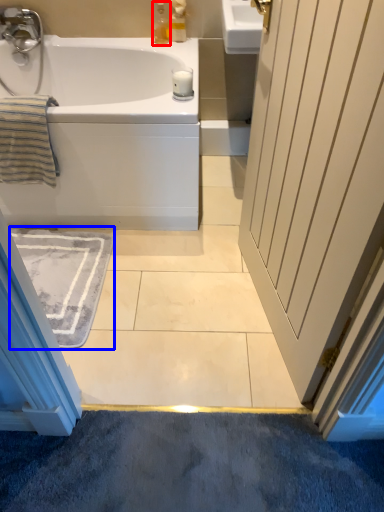
Question: Among these objects, which one is farthest to the camera, soap dispenser (highlighted by a red box) or bath mat (highlighted by a blue box)?

Choices:
 (A) soap dispenser
 (B) bath mat

Answer: (A)